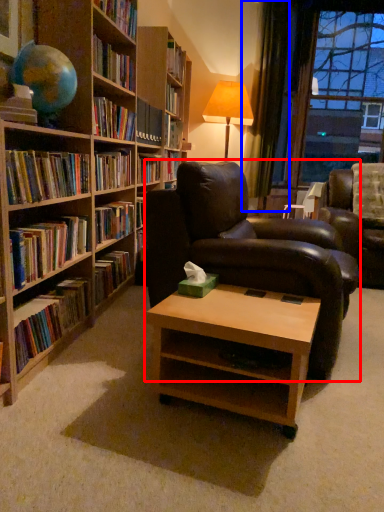
Question: Which object appears farthest to the camera in this image, chair (highlighted by a red box) or curtain (highlighted by a blue box)?

Choices:
 (A) chair
 (B) curtain

Answer: (B)